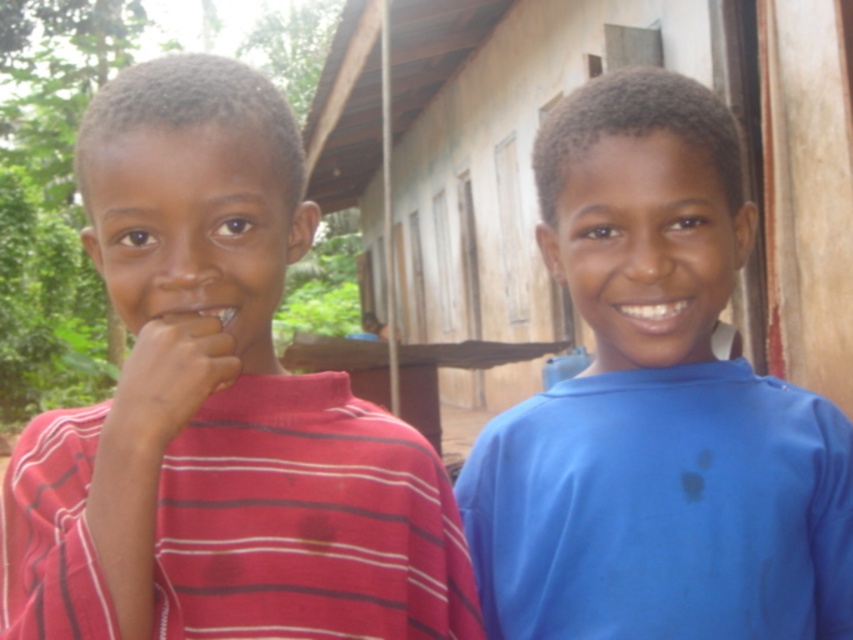
Is striped cotton shirt at left shorter than blue matte shirt at right?

Correct, striped cotton shirt at left is not as tall as blue matte shirt at right.

Does striped cotton shirt at left have a greater height compared to blue matte shirt at right?

No, striped cotton shirt at left is not taller than blue matte shirt at right.

Which is in front, point (177, 436) or point (793, 589)?

Point (177, 436) is in front.

This screenshot has height=640, width=853. Identify the location of striped cotton shirt at left. (218, 410).

Between blue matte shirt at right and matte skin hand at left, which one is positioned lower?

Positioned lower is matte skin hand at left.

Consider the image. Who is positioned more to the right, blue matte shirt at right or matte skin hand at left?

Positioned to the right is blue matte shirt at right.

Identify the location of blue matte shirt at right. (656, 404).

Between point (286, 227) and point (198, 342), which one is positioned behind?

Positioned behind is point (286, 227).

Is striped cotton shirt at left smaller than matte skin hand at left?

Actually, striped cotton shirt at left might be larger than matte skin hand at left.

Between point (148, 417) and point (129, 403), which one is positioned in front?

Point (148, 417) is in front.

This screenshot has height=640, width=853. What are the coordinates of `striped cotton shirt at left` in the screenshot? It's located at (218, 410).